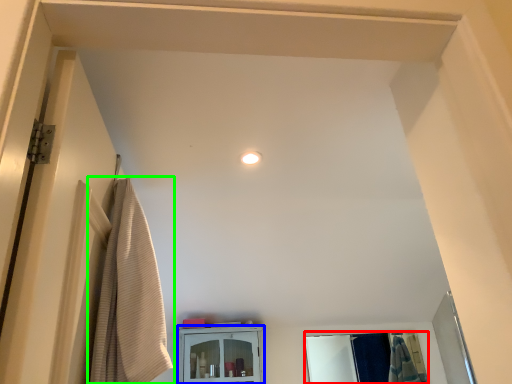
Question: Considering the real-world distances, which object is closest to mirror (highlighted by a red box)? cabinetry (highlighted by a blue box) or curtain (highlighted by a green box).

Choices:
 (A) cabinetry
 (B) curtain

Answer: (A)